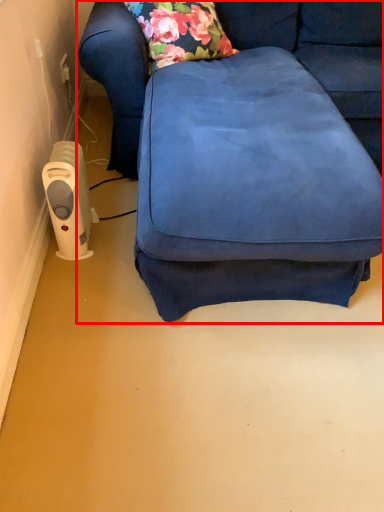
Question: Considering the relative positions of studio couch (annotated by the red box) and appliance in the image provided, where is studio couch (annotated by the red box) located with respect to the staircase?

Choices:
 (A) left
 (B) right

Answer: (B)